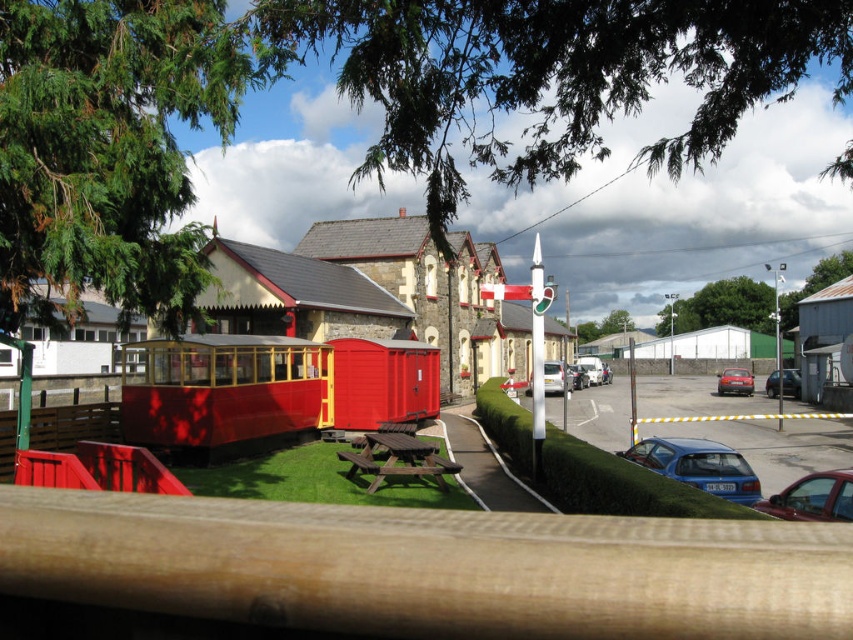
Question: Which object appears closest to the camera in this image?

Choices:
 (A) smooth red train car at center
 (B) shiny red sedan at lower right
 (C) brown wooden picnic table at center

Answer: (B)

Question: Among these points, which one is nearest to the camera?

Choices:
 (A) (635, 451)
 (B) (358, 396)
 (C) (738, 392)

Answer: (A)

Question: Does smooth red train car at center lie in front of brown wooden picnic table at center?

Choices:
 (A) no
 (B) yes

Answer: (A)

Question: Is smooth red train at center smaller than metallic blue car at right?

Choices:
 (A) no
 (B) yes

Answer: (A)

Question: Is shiny red sedan at lower right closer to camera compared to metallic silver car at center?

Choices:
 (A) no
 (B) yes

Answer: (B)

Question: Which is farther from the metallic blue car at center?

Choices:
 (A) shiny red sedan at lower right
 (B) smooth red train car at center
 (C) blue glossy hatchback at lower right

Answer: (A)